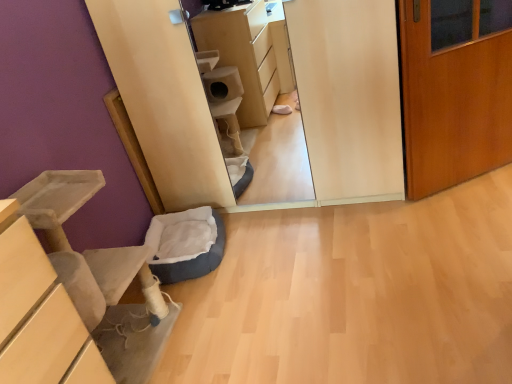
Question: From the image's perspective, is dark blue plush cat bed at lower left located above or below soft gray cat bed at lower left?

Choices:
 (A) below
 (B) above

Answer: (B)

Question: Based on their sizes in the image, would you say dark blue plush cat bed at lower left is bigger or smaller than soft gray cat bed at lower left?

Choices:
 (A) small
 (B) big

Answer: (A)

Question: Which object is positioned closest to the wooden door at right?

Choices:
 (A) dark blue plush cat bed at lower left
 (B) soft gray cat bed at lower left

Answer: (A)

Question: Which object is the farthest from the dark blue plush cat bed at lower left?

Choices:
 (A) soft gray cat bed at lower left
 (B) wooden door at right

Answer: (B)